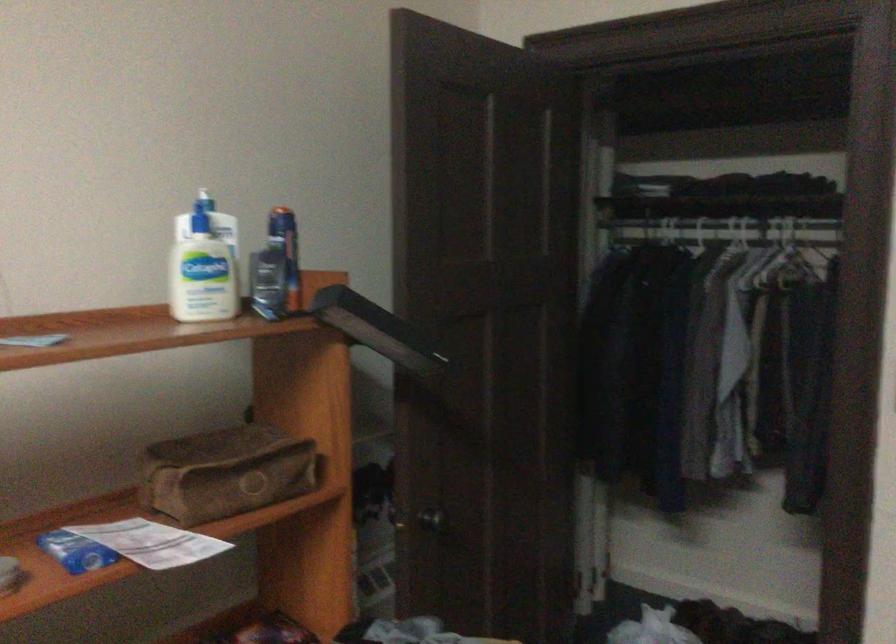
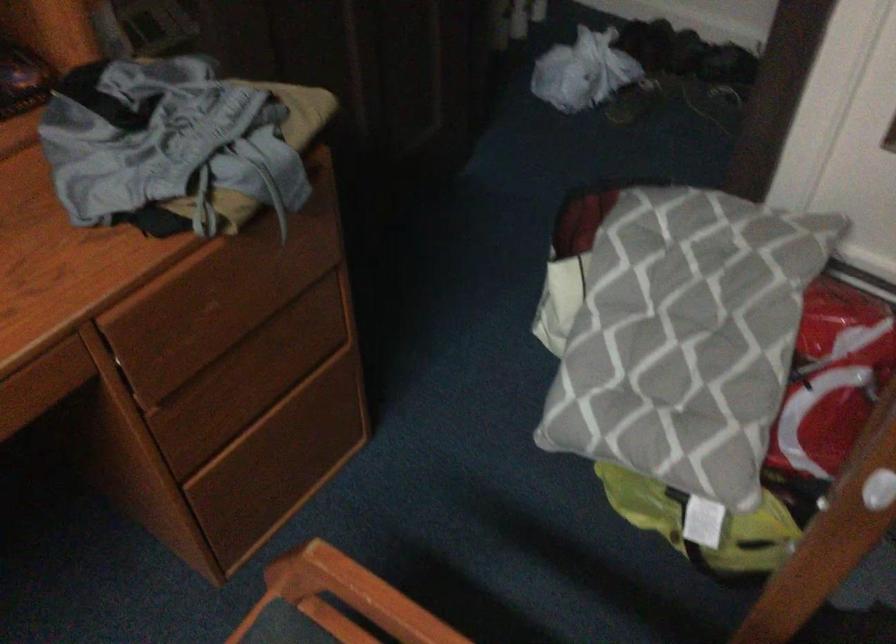
Question: The first image is from the beginning of the video and the second image is from the end. How did the camera likely rotate when shooting the video?

Choices:
 (A) Left
 (B) Right
 (C) Up
 (D) Down

Answer: (D)